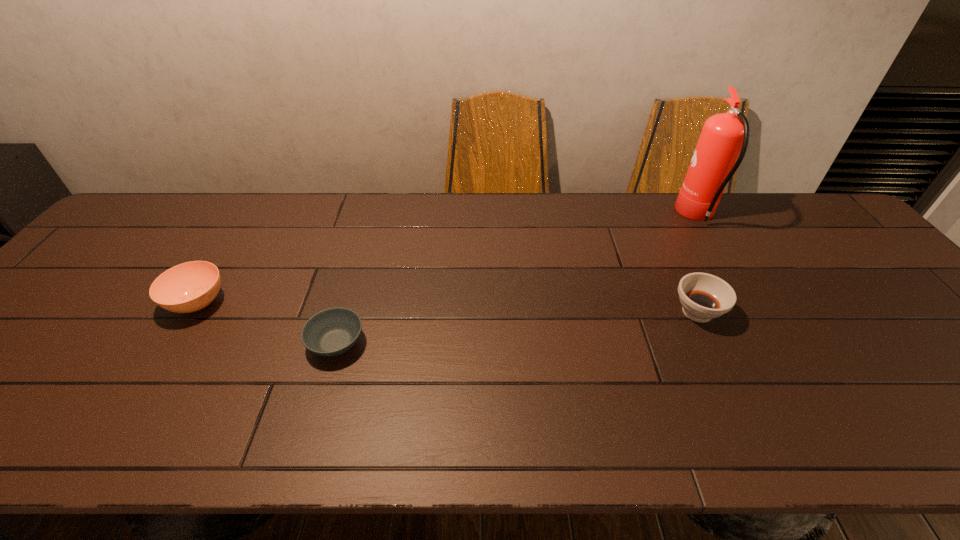
Locate an element on the screen. This screenshot has height=540, width=960. the tallest object is located at coordinates (723, 141).

You are a GUI agent. You are given a task and a screenshot of the screen. Output one action in this format:
    pyautogui.click(x=<x>, y=<y>)
    Task: Click on the rightmost object
    This screenshot has width=960, height=540.
    Given the screenshot: What is the action you would take?
    pyautogui.click(x=723, y=141)

The width and height of the screenshot is (960, 540). Find the location of `the rightmost soup bowl`. the rightmost soup bowl is located at coordinates (703, 296).

Locate an element on the screen. the leftmost object is located at coordinates (188, 287).

The height and width of the screenshot is (540, 960). Identify the location of the shortest soup bowl. (331, 332).

Identify the location of the second soup bowl from left to right. (331, 332).

Find the location of a particular element. Image resolution: width=960 pixels, height=540 pixels. vacant position located 0.140m towards the nozzle of the tallest object is located at coordinates (634, 216).

Where is `vacant region located towards the nozzle of the tallest object`? The width and height of the screenshot is (960, 540). vacant region located towards the nozzle of the tallest object is located at coordinates (647, 216).

This screenshot has height=540, width=960. What are the coordinates of `vacant space situated towards the nozzle of the tallest object` in the screenshot? It's located at pos(621,216).

What are the coordinates of `free region located 0.390m on the back of the rightmost soup bowl` in the screenshot? It's located at (647, 206).